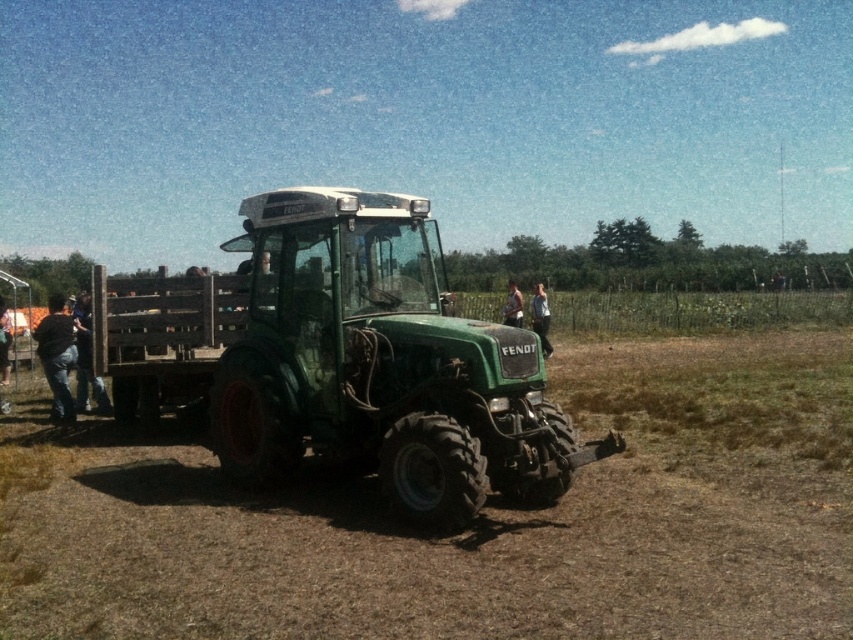
Can you confirm if light brown leather jacket at center is shorter than denim pants at lower left?

No.

Between light brown leather jacket at center and denim pants at lower left, which one appears on the right side from the viewer's perspective?

From the viewer's perspective, light brown leather jacket at center appears more on the right side.

This screenshot has width=853, height=640. What do you see at coordinates (541, 317) in the screenshot?
I see `light brown leather jacket at center` at bounding box center [541, 317].

This screenshot has width=853, height=640. In order to click on light brown leather jacket at center in this screenshot , I will do `click(541, 317)`.

Which is below, dull brown dirt at center or dark blue jeans at center?

Positioned lower is dull brown dirt at center.

Based on the photo, which of these two, dull brown dirt at center or dark blue jeans at center, stands shorter?

Standing shorter between the two is dull brown dirt at center.

I want to click on dull brown dirt at center, so click(x=473, y=524).

Where is `dull brown dirt at center`? dull brown dirt at center is located at coordinates (473, 524).

Which is more to the right, dull brown dirt at center or denim pants at lower left?

dull brown dirt at center

Is dull brown dirt at center positioned before denim pants at lower left?

That is True.

The image size is (853, 640). I want to click on dull brown dirt at center, so point(473,524).

Where is `dull brown dirt at center`? The height and width of the screenshot is (640, 853). dull brown dirt at center is located at coordinates (473, 524).